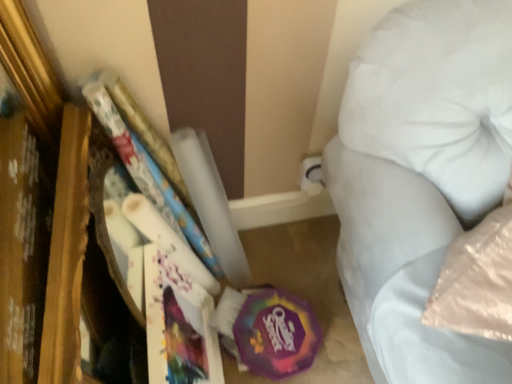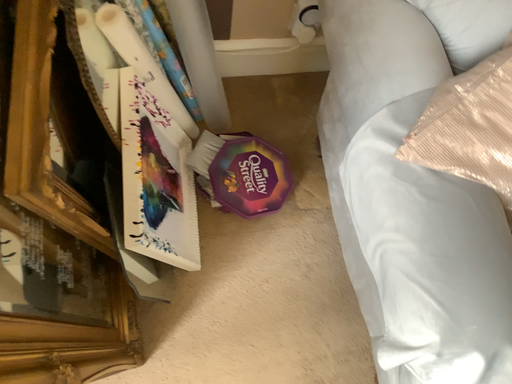
Question: Which way did the camera rotate in the video?

Choices:
 (A) rotated downward
 (B) rotated upward

Answer: (A)